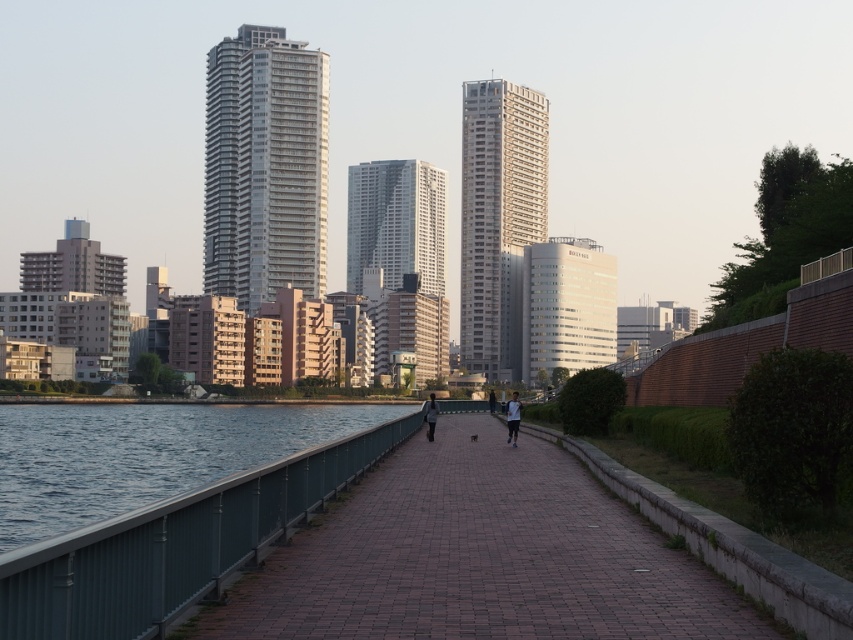
You are a photographer standing on the walkway and want to capture both the white glass skyscraper at center and the dark gray fabric jacket at center in a single frame. Which object should you focus on first to ensure both are in the frame?

You should focus on the white glass skyscraper at center first because it is taller than the dark gray fabric jacket at center, so adjusting the focus to accommodate its height will naturally include the shorter jacket in the frame.

You are standing on the waterfront walkway and want to take a photo of the glossy glass building at center without including the green metallic railing at lower left in the shot. Based on their positions, is this possible?

The green metallic railing at lower left is to the left of the glossy glass building at center, so if you position yourself to the right side of the walkway and aim your camera towards the building while avoiding the railing, it should be possible to capture the glossy glass building at center without including the green metallic railing at lower left in the frame.